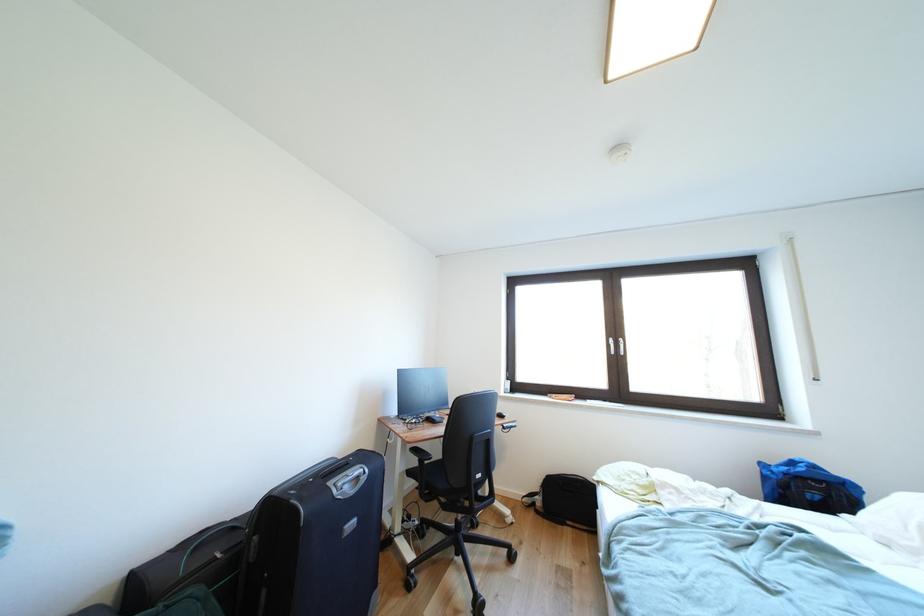
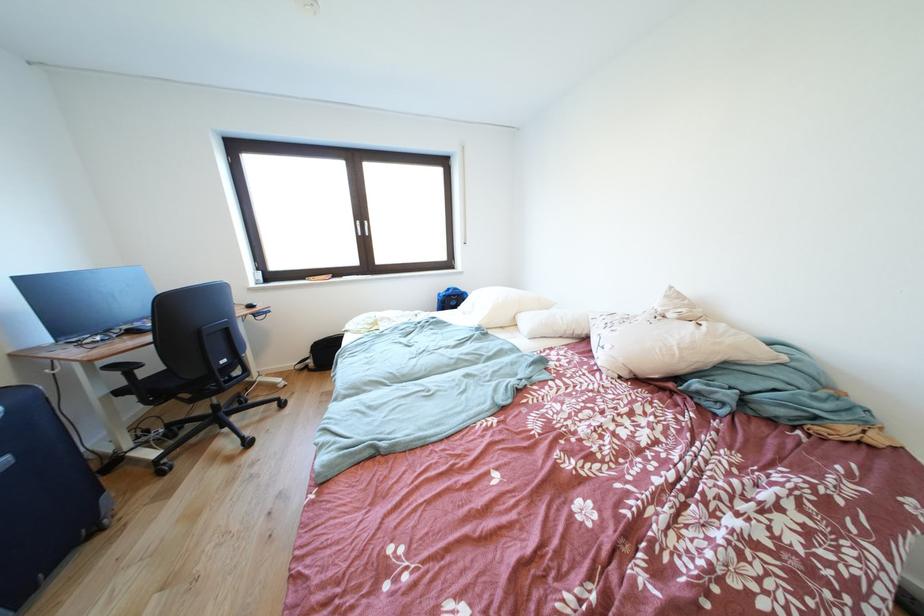
In the second image, find the point that corresponds to pixel 359 530 in the first image.

(8, 468)